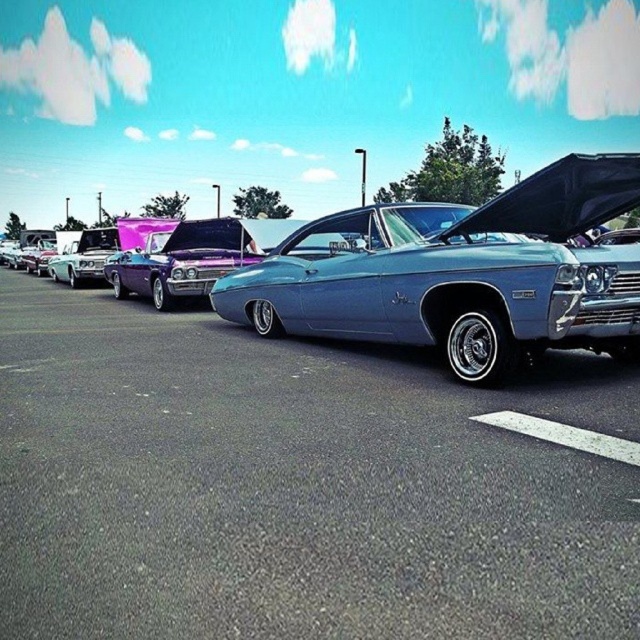
Can you confirm if metallic blue car at center is smaller than shiny chrome truck at left?

Yes.

Is point (20, 579) positioned behind point (93, 250)?

No, it is in front of (93, 250).

Between point (296, 579) and point (97, 234), which one is positioned in front?

Point (296, 579) is more forward.

What are the coordinates of `metallic blue car at center` in the screenshot? It's located at (294, 484).

Can you confirm if metallic blue car at center is positioned above metallic blue muscle car at center?

No, metallic blue car at center is not above metallic blue muscle car at center.

Does point (236, 433) lie in front of point (465, 358)?

Yes, point (236, 433) is in front of point (465, 358).

Where is `metallic blue car at center`? The height and width of the screenshot is (640, 640). metallic blue car at center is located at coordinates (294, 484).

Can you confirm if metallic blue car at center is positioned to the left of shiny blue hood at center?

Correct, you'll find metallic blue car at center to the left of shiny blue hood at center.

Who is more distant from viewer, (196,410) or (554,188)?

The point (554,188) is behind.

This screenshot has width=640, height=640. Find the location of `metallic blue car at center`. metallic blue car at center is located at coordinates (294, 484).